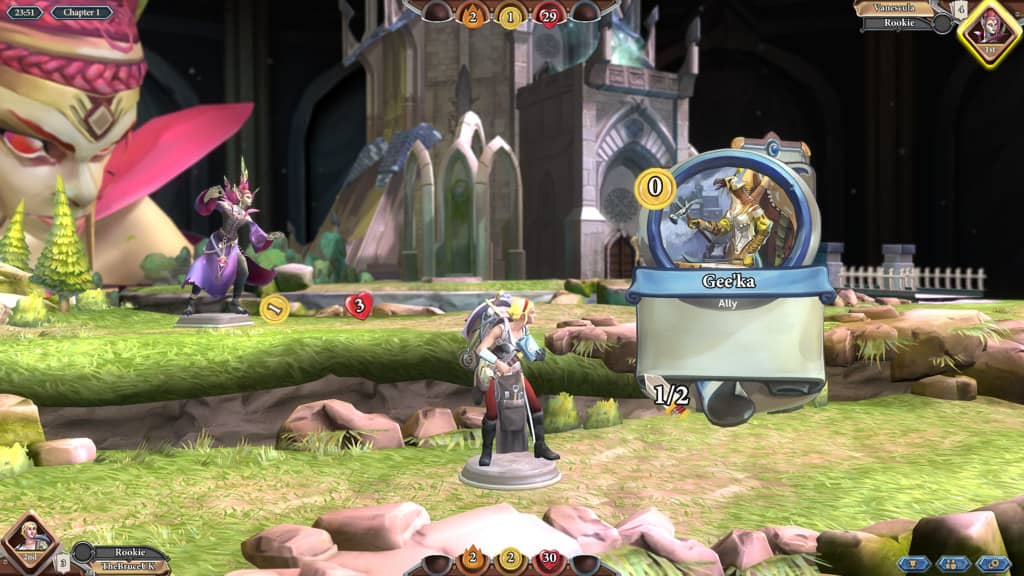
The height and width of the screenshot is (576, 1024). Identify the location of action figure. (231, 222).